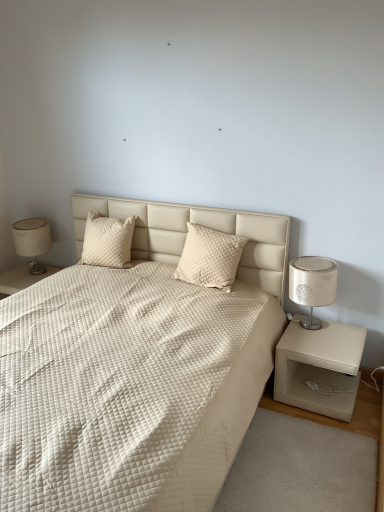
This screenshot has width=384, height=512. What are the coordinates of `free space in front of white textured lamp at right` in the screenshot? It's located at (338, 347).